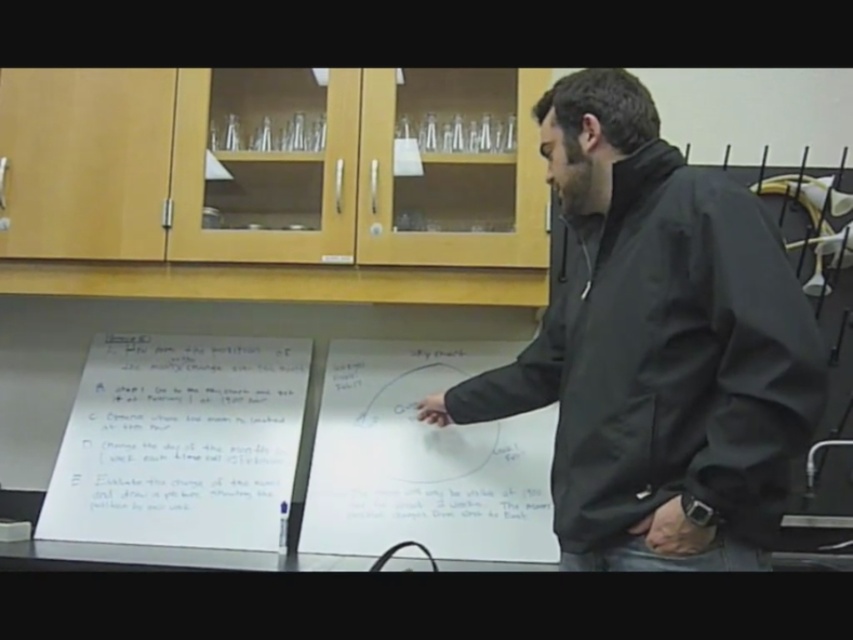
Is point (666, 339) positioned before point (125, 492)?

Yes, point (666, 339) is closer to viewer.

Who is shorter, black matte jacket at center or white paper at center?

white paper at center is shorter.

Measure the distance between point (x=647, y=451) and camera.

Point (x=647, y=451) is 3.54 feet away from camera.

The height and width of the screenshot is (640, 853). I want to click on black matte jacket at center, so click(x=657, y=348).

Where is `black matte jacket at center`? black matte jacket at center is located at coordinates (657, 348).

This screenshot has height=640, width=853. What are the coordinates of `black matte jacket at center` in the screenshot? It's located at (657, 348).

Who is positioned more to the left, white paper at center or white matte board at center?

white paper at center is more to the left.

Does white paper at center have a lesser width compared to white matte board at center?

Incorrect, white paper at center's width is not less than white matte board at center's.

The image size is (853, 640). Find the location of `white paper at center`. white paper at center is located at coordinates (180, 442).

I want to click on white paper at center, so click(x=180, y=442).